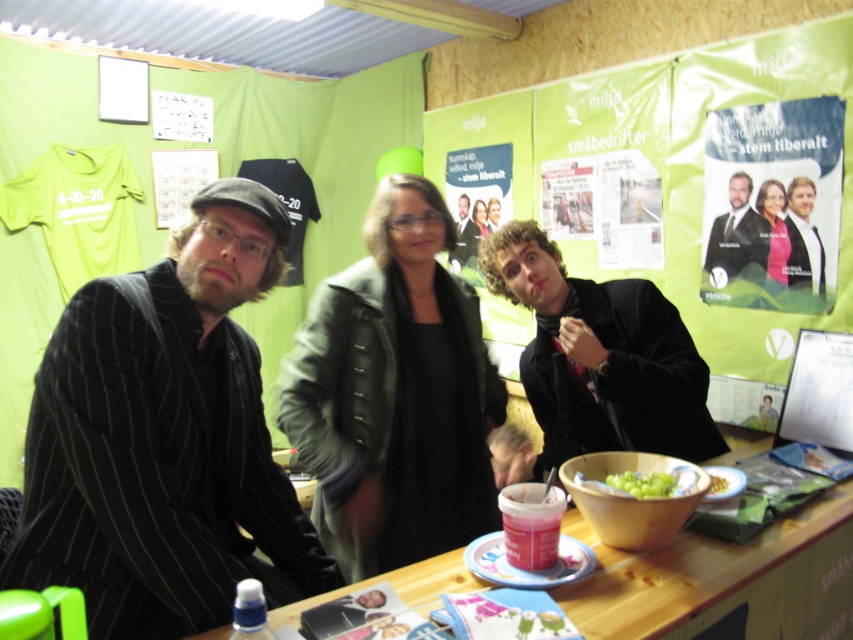
Is point (734, 196) positioned after point (483, 228)?

No, (734, 196) is closer to viewer.

Does matte black suit at center appear on the left side of smooth black suit at center?

Incorrect, matte black suit at center is not on the left side of smooth black suit at center.

Who is more forward, (x=766, y=250) or (x=480, y=225)?

Point (x=766, y=250) is more forward.

Locate an element on the screen. matte black suit at center is located at coordinates (738, 234).

Who is positioned more to the right, black pinstripe suit at left or matte black suit at center?

matte black suit at center

Is the position of black pinstripe suit at left less distant than that of matte black suit at center?

Yes, it is in front of matte black suit at center.

Is point (70, 426) positioned after point (759, 236)?

That is False.

Find the location of `black pinstripe suit at left`. black pinstripe suit at left is located at coordinates (165, 438).

Can you confirm if shiny black jacket at center is smaller than smooth black suit at upper right?

Incorrect, shiny black jacket at center is not smaller in size than smooth black suit at upper right.

The width and height of the screenshot is (853, 640). What are the coordinates of `shiny black jacket at center` in the screenshot? It's located at (598, 358).